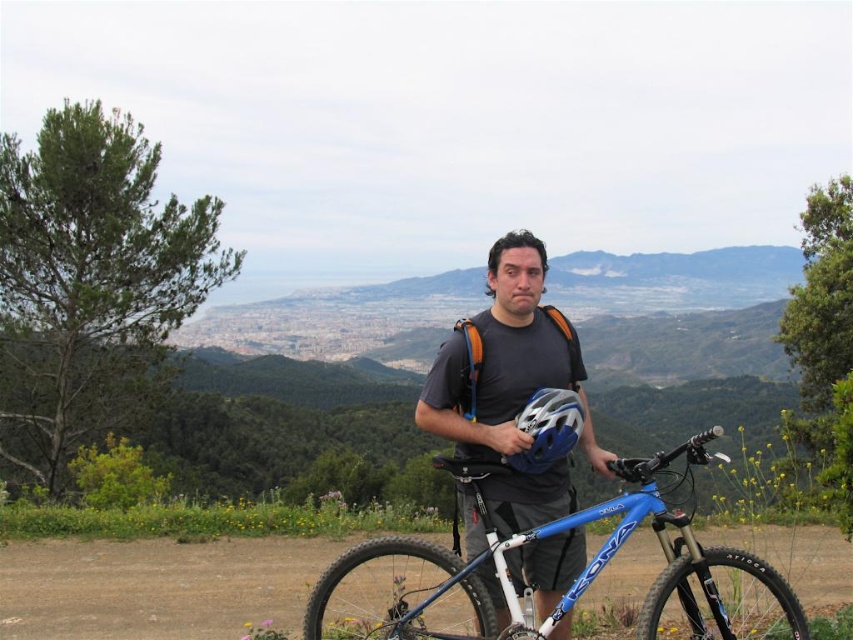
You are a drone operator trying to capture a photo of the point at coordinates (532, 387). The drone is currently at a height of 25 feet. Is the drone above or below the point?

The distance of point (532, 387) from the camera is 26.81 feet. Since the drone is at 25 feet, it is below the point.

You are a cyclist who wants to secure your gear properly before starting a ride. You have a blue metallic bicycle at center and a matte black helmet at center. Given the space between them, can you place both items side by side on a 7 feet wide rack without overlapping?

The distance between the blue metallic bicycle at center and the matte black helmet at center is 6.69 feet. Since the rack is 7 feet wide, you can place both items side by side without overlapping as the total space required is less than the rack width.